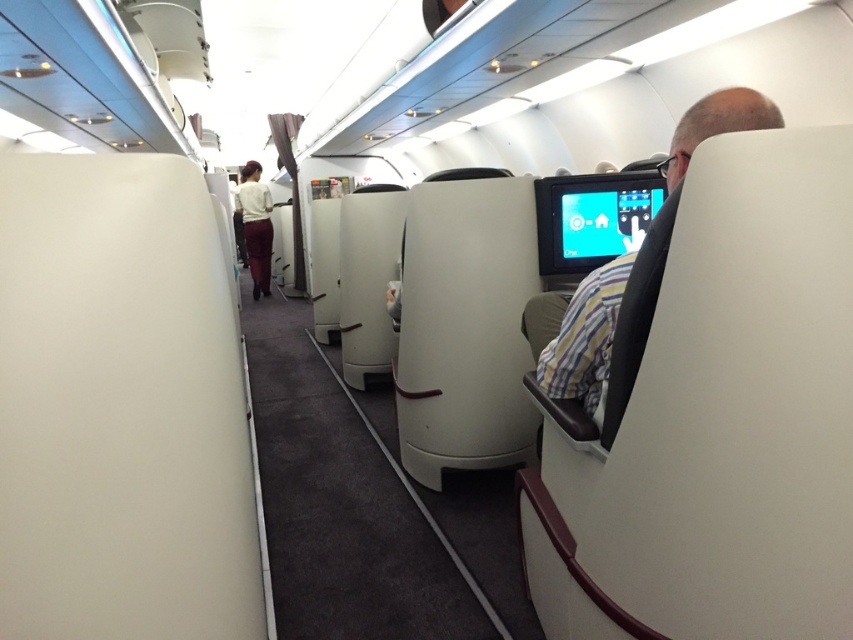
You are a flight attendant standing in the business class cabin. You need to deliver a drink to the passenger wearing the striped fabric shirt at right and the passenger in the white fabric uniform at center. Which passenger is seated to the left of the other?

The striped fabric shirt at right is positioned on the right side of the white fabric uniform at center, so the passenger in the white fabric uniform at center is seated to the left of the passenger wearing the striped fabric shirt at right.

You are a passenger seated in the business class section of an airplane. You notice two points marked in the cabin. The first point is at coordinate point (770, 125) and the second is at coordinate point (264, 289). Which point is closer to your current position?

The point at coordinate point (770, 125) is closer to your current position because it is closer to the camera than point (264, 289).

You are an airline attendant checking the seating arrangement. You see a striped fabric shirt at right and a white fabric uniform at center. Which clothing item appears shorter in the image?

The striped fabric shirt at right has a lesser height compared to the white fabric uniform at center, so the striped fabric shirt at right appears shorter.